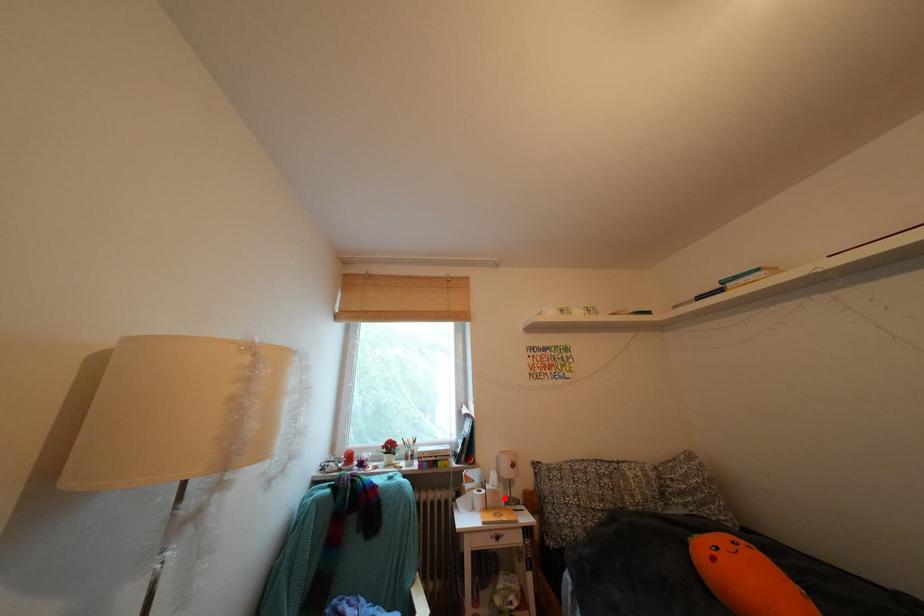
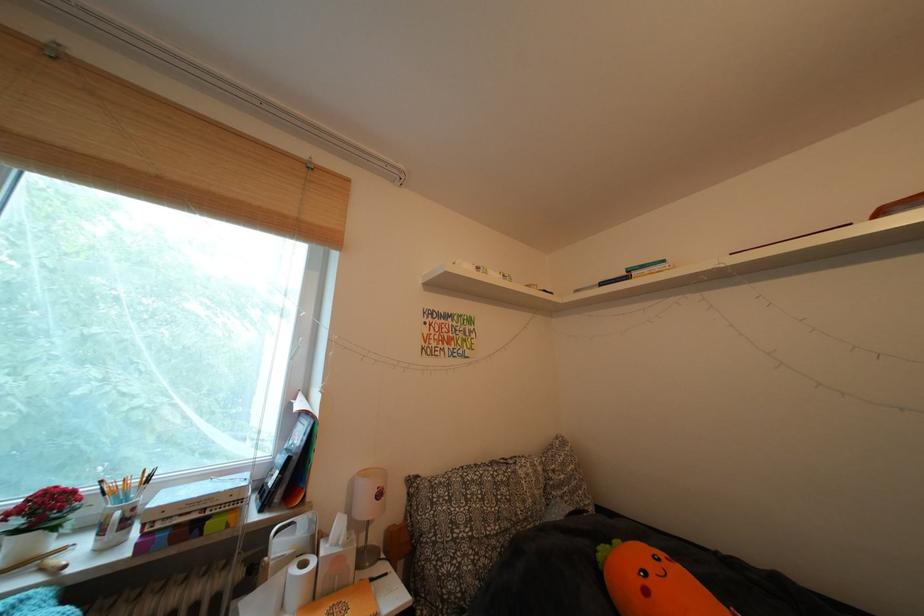
Question: I am providing you with two images of the same scene from different viewpoints. Image1 has a red point marked. In image2, the corresponding 3D location appears at what relative position? Reply with the corresponding letter.

Choices:
 (A) Closer
 (B) Farther

Answer: (A)